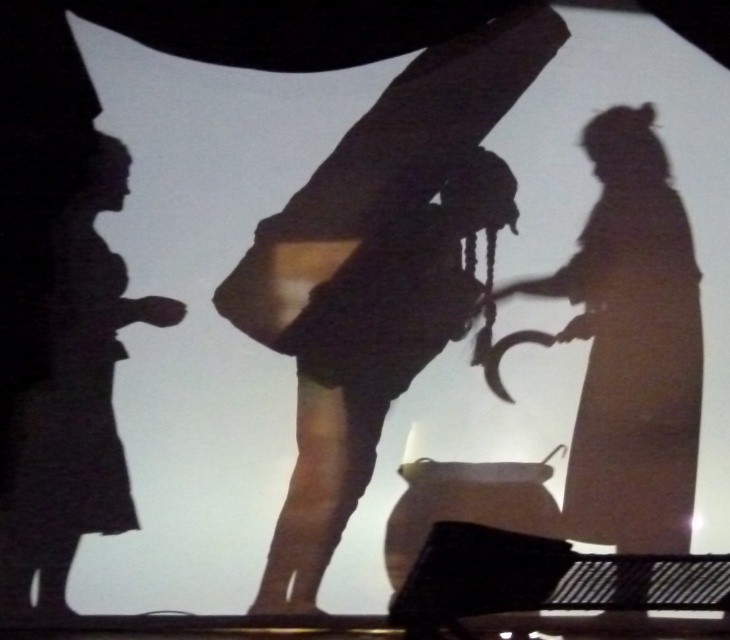
Does silhouette figure at center appear on the right side of black matte figure at left?

Indeed, silhouette figure at center is positioned on the right side of black matte figure at left.

Is silhouette figure at center bigger than black matte figure at left?

Yes, silhouette figure at center is bigger than black matte figure at left.

Who is more distant from viewer, (584, 273) or (20, 504)?

Positioned behind is point (584, 273).

Image resolution: width=730 pixels, height=640 pixels. What are the coordinates of `silhouette figure at center` in the screenshot? It's located at (631, 346).